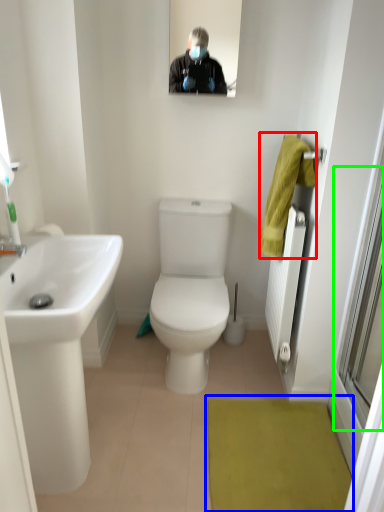
Question: Which object is positioned closest to hand towel (highlighted by a red box)? Select from bath mat (highlighted by a blue box) and window screen (highlighted by a green box).

Choices:
 (A) bath mat
 (B) window screen

Answer: (B)